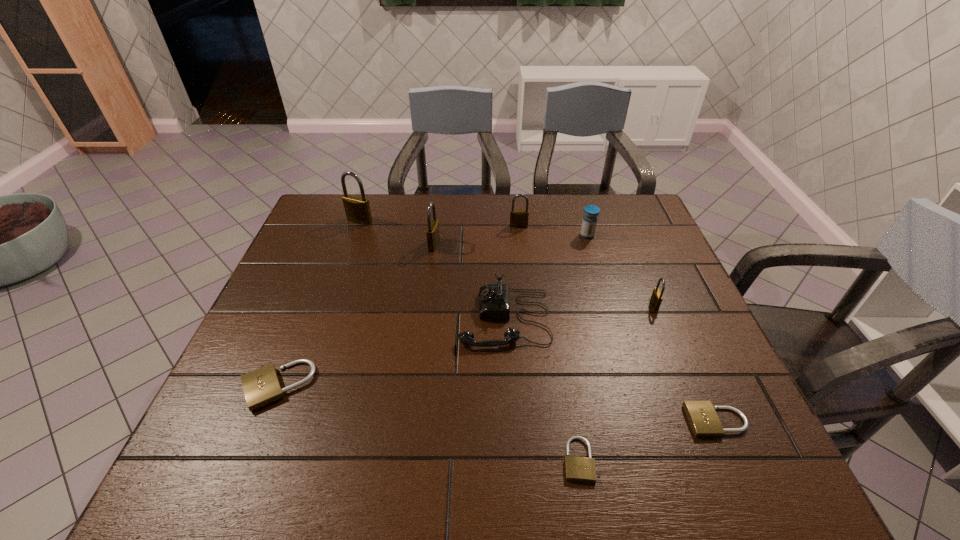
Point out which padlock is positioned as the nearest to the medicine. Please provide its 2D coordinates. Your answer should be formatted as a tuple, i.e. [(x, y)], where the tuple contains the x and y coordinates of a point satisfying the conditions above.

[(518, 218)]

The image size is (960, 540). What are the coordinates of `padlock that is the nearest to the smallest beige padlock` in the screenshot? It's located at (703, 419).

Identify which brass padlock is the third closest to the nearest brass padlock. Please provide its 2D coordinates. Your answer should be formatted as a tuple, i.e. [(x, y)], where the tuple contains the x and y coordinates of a point satisfying the conditions above.

[(357, 209)]

This screenshot has height=540, width=960. In order to click on brass padlock that stands as the second closest to the second brass padlock from right to left in this screenshot , I will do `click(656, 298)`.

I want to click on beige padlock that stands as the second closest to the telephone, so click(703, 419).

Where is `the second closest beige padlock relative to the third shortest object`? The image size is (960, 540). the second closest beige padlock relative to the third shortest object is located at coordinates (703, 419).

Find the location of a particular element. free region that satisfies the following two spatial constraints: 1. on the dial of the telephone; 2. on the left side of the shortest object is located at coordinates (513, 460).

Find the location of a particular element. free region that satisfies the following two spatial constraints: 1. on the dial of the telephone; 2. on the left side of the shortest padlock is located at coordinates (513, 460).

Locate an element on the screen. The image size is (960, 540). vacant point that satisfies the following two spatial constraints: 1. on the back side of the fifth tallest padlock; 2. on the left side of the nearest brass padlock is located at coordinates (309, 305).

Where is `blank space that satisfies the following two spatial constraints: 1. on the front side of the second beige padlock from left to right; 2. on the left side of the third brass padlock from left to right`? The image size is (960, 540). blank space that satisfies the following two spatial constraints: 1. on the front side of the second beige padlock from left to right; 2. on the left side of the third brass padlock from left to right is located at coordinates (544, 460).